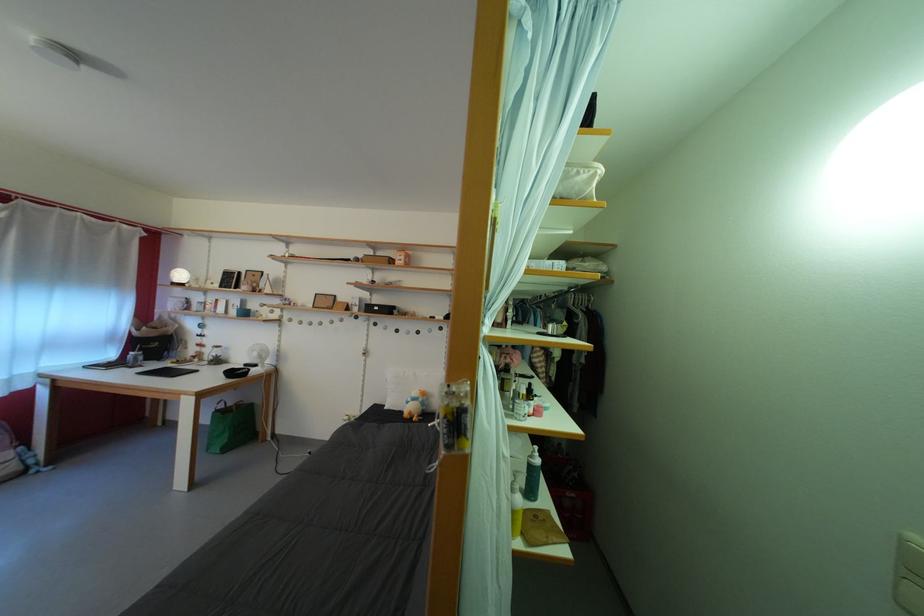
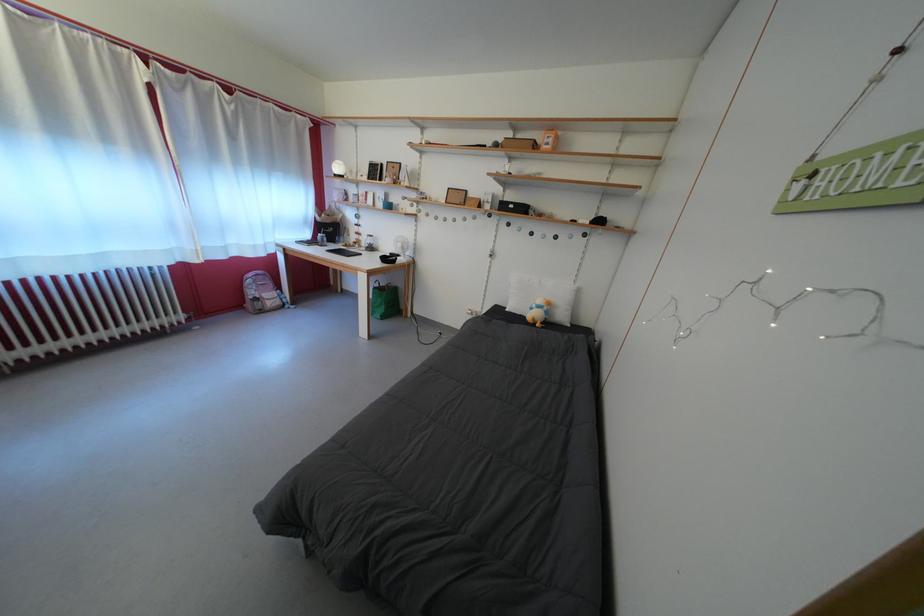
Locate, in the second image, the point that corresponds to point 418,405 in the first image.

(542, 312)